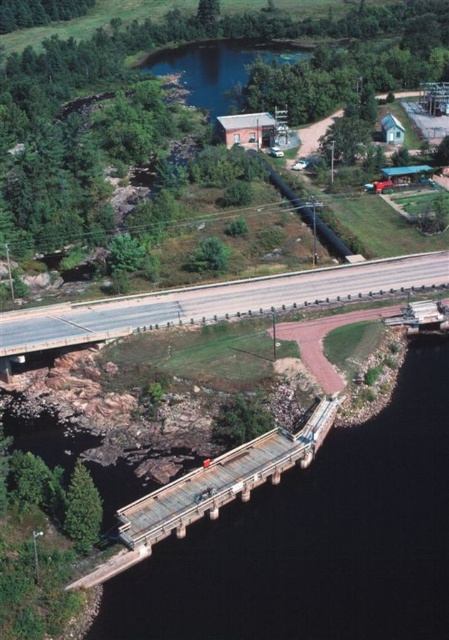
Locate an element on the screen. Image resolution: width=449 pixels, height=640 pixels. asphalt road at center is located at coordinates (214, 301).

Can you confirm if asphalt road at center is positioned to the right of rusty metal bridge at center?

In fact, asphalt road at center is to the left of rusty metal bridge at center.

Who is more forward, (215, 296) or (193, 480)?

Point (193, 480) is more forward.

This screenshot has height=640, width=449. Find the location of `asphalt road at center`. asphalt road at center is located at coordinates (214, 301).